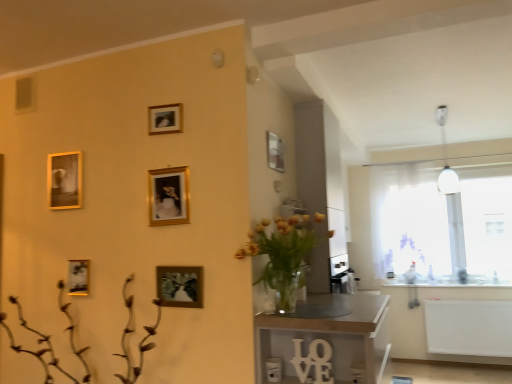
This screenshot has height=384, width=512. In order to click on free space above white matte radiator at lower right (from a real-world perspective) in this screenshot , I will do `click(475, 299)`.